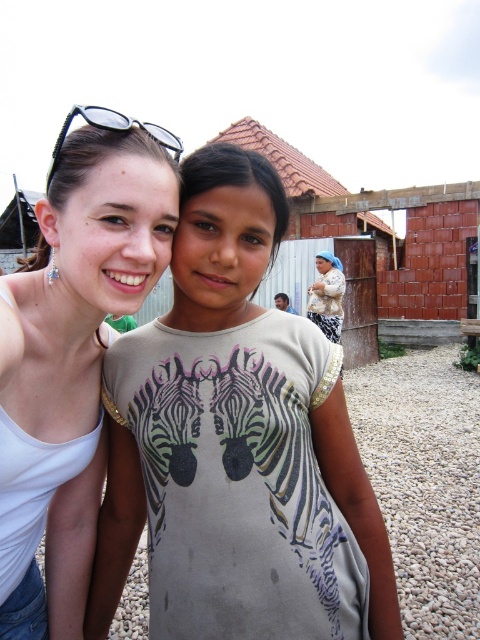
You are a photographer trying to capture a portrait of the two individuals in the scene. You notice the light beige fabric dress at center and the beige textured shawl at center. Which clothing item should you avoid placing in the foreground to prevent blocking the subjects, considering their sizes?

You should avoid placing the light beige fabric dress at center in the foreground because it might be wider than the beige textured shawl at center, potentially blocking the subjects more.

You are a photographer trying to capture a candid shot of the two people in the scene. You want to ensure that both the light beige fabric dress at center and the white matte tank top at upper left are clearly visible in the frame. Given their sizes, which clothing item might require more careful framing to avoid being cut off?

The light beige fabric dress at center has a larger width than the white matte tank top at upper left, so it might require more careful framing to avoid being cut off due to its greater size.

What are the coordinates of the white matte tank top at upper left?

The white matte tank top at upper left is located at point (83,321).